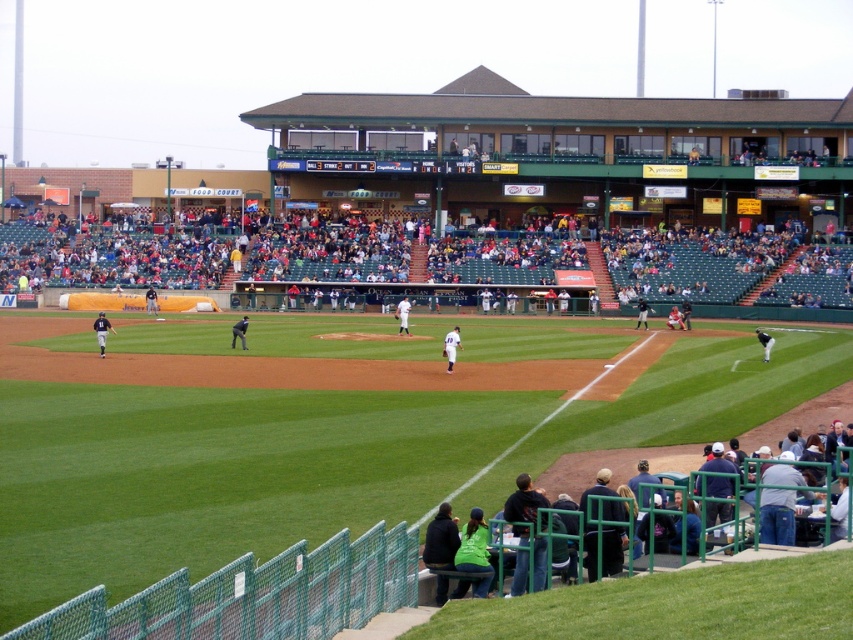
Between white jersey baseball players at lower right and white jersey uniform at center, which one is positioned lower?

white jersey baseball players at lower right is below.

Is white jersey baseball players at lower right wider than white jersey uniform at center?

Correct, the width of white jersey baseball players at lower right exceeds that of white jersey uniform at center.

Between point (685, 467) and point (756, 336), which one is positioned in front?

Point (685, 467) is more forward.

The width and height of the screenshot is (853, 640). I want to click on white jersey baseball players at lower right, so click(x=614, y=465).

Does green grass baseball field at center have a smaller size compared to white uniform at center?

Incorrect, green grass baseball field at center is not smaller in size than white uniform at center.

Does point (659, 433) come closer to viewer compared to point (408, 305)?

That is True.

Which is in front, point (585, 449) or point (395, 310)?

Point (585, 449) is more forward.

This screenshot has height=640, width=853. Identify the location of green grass baseball field at center. tap(218, 474).

Does green grass baseball field at center lie behind orange jersey at center?

No, green grass baseball field at center is in front of orange jersey at center.

Can you confirm if green grass baseball field at center is thinner than orange jersey at center?

No, green grass baseball field at center is not thinner than orange jersey at center.

Image resolution: width=853 pixels, height=640 pixels. What do you see at coordinates (218, 474) in the screenshot? I see `green grass baseball field at center` at bounding box center [218, 474].

Find the location of a particular element. green grass baseball field at center is located at coordinates (218, 474).